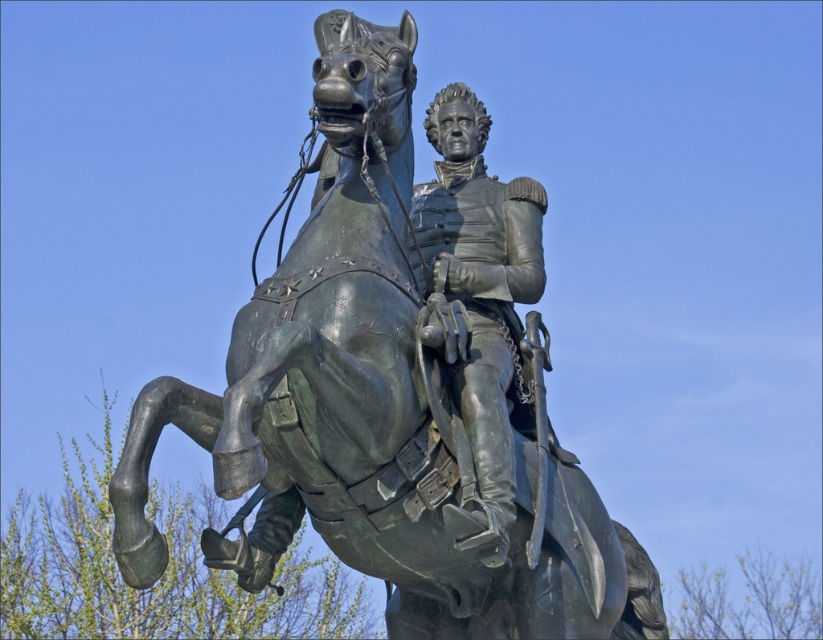
Who is taller, bronze statue at center or shiny bronze uniform at center?

Standing taller between the two is bronze statue at center.

Locate an element on the screen. This screenshot has height=640, width=823. bronze statue at center is located at coordinates (374, 408).